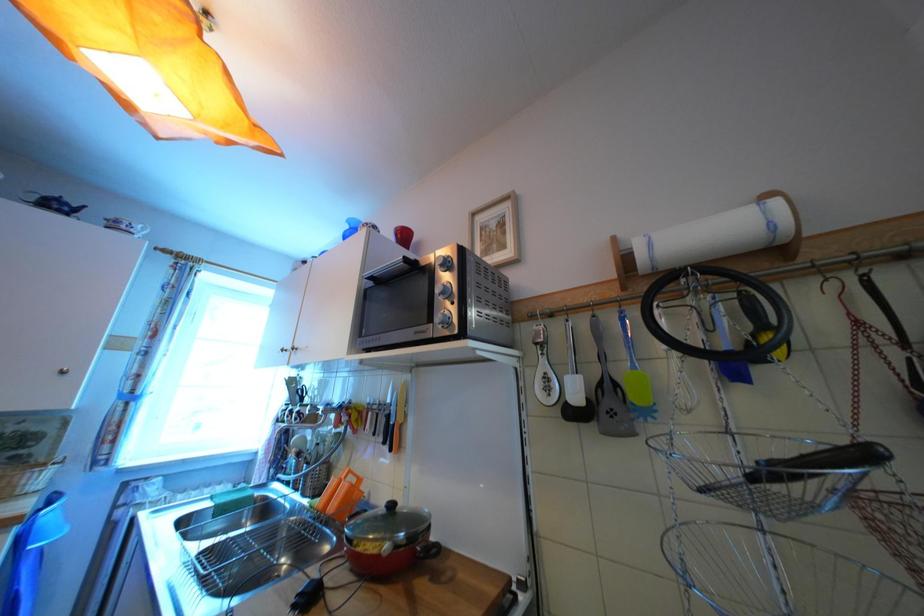
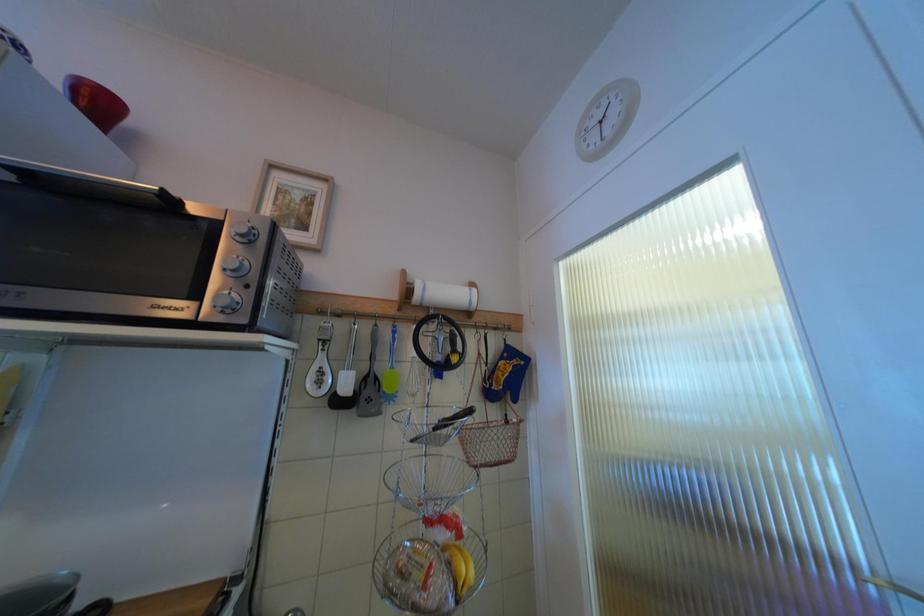
Question: The first image is from the beginning of the video and the second image is from the end. How did the camera likely rotate when shooting the video?

Choices:
 (A) Left
 (B) Right
 (C) Up
 (D) Down

Answer: (B)